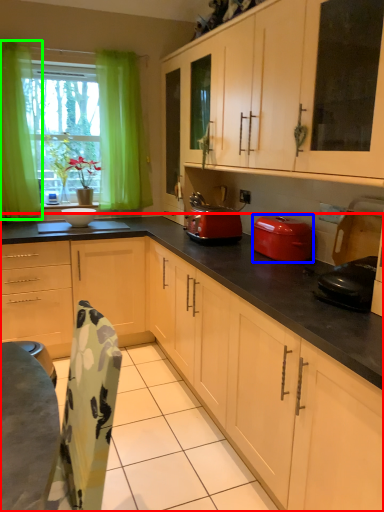
Question: Which is farther away from cabinetry (highlighted by a red box)? kitchen appliance (highlighted by a blue box) or curtain (highlighted by a green box)?

Choices:
 (A) kitchen appliance
 (B) curtain

Answer: (B)